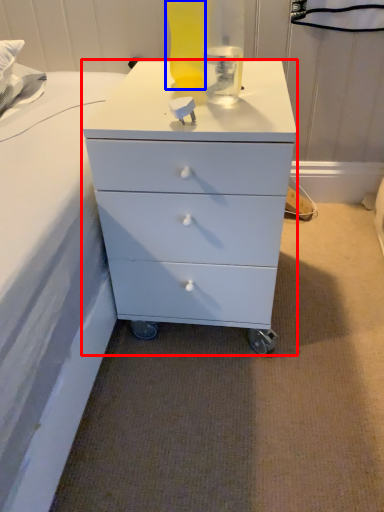
Question: Among these objects, which one is farthest to the camera, chest of drawers (highlighted by a red box) or bottle (highlighted by a blue box)?

Choices:
 (A) chest of drawers
 (B) bottle

Answer: (B)